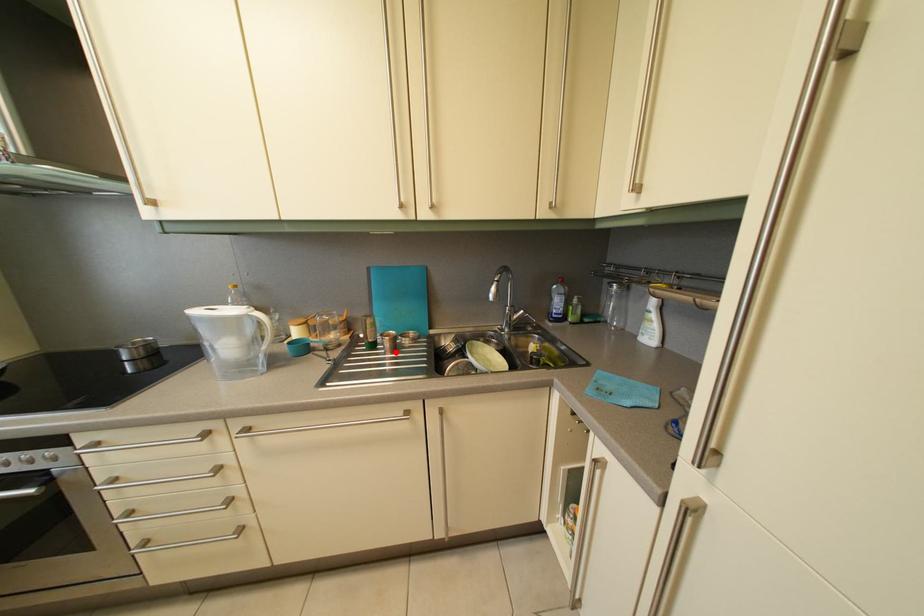
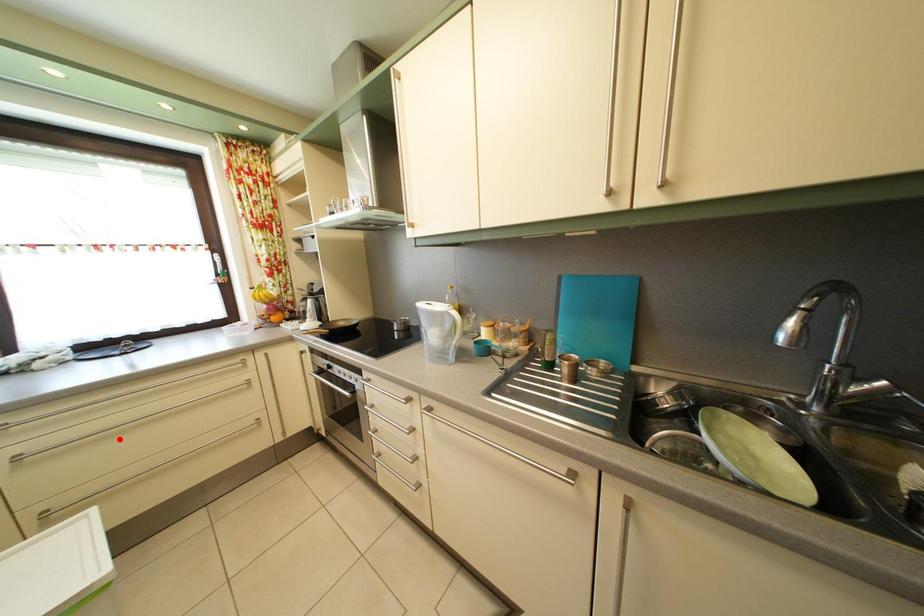
I am providing you with two images of the same scene from different viewpoints. A red point is marked on the first image and another point is marked on the second image. Is the marked point in image1 the same physical position as the marked point in image2?

No